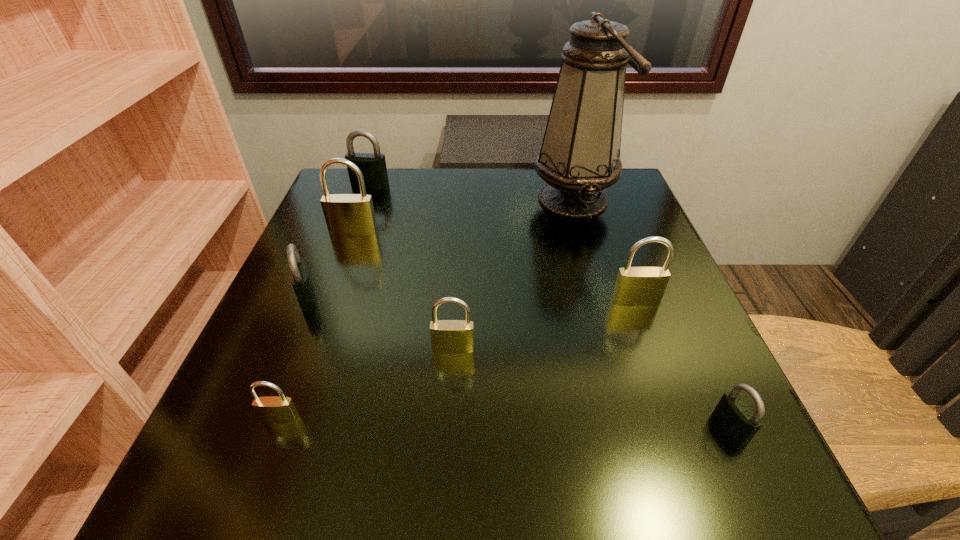
The height and width of the screenshot is (540, 960). Find the location of `the fourth object from right to left`. the fourth object from right to left is located at coordinates (447, 336).

Where is `the rightmost object`? The width and height of the screenshot is (960, 540). the rightmost object is located at coordinates (734, 416).

In order to click on the nearest black padlock in this screenshot , I will do `click(734, 416)`.

Where is `the nearest brass padlock`? The image size is (960, 540). the nearest brass padlock is located at coordinates (270, 409).

Locate an element on the screen. Image resolution: width=960 pixels, height=540 pixels. vacant space positioned on the front of the tallest object is located at coordinates point(600,296).

Where is `free spot located 0.250m on the front-facing side of the sixth nearest padlock`? This screenshot has height=540, width=960. free spot located 0.250m on the front-facing side of the sixth nearest padlock is located at coordinates (323, 319).

Locate an element on the screen. Image resolution: width=960 pixels, height=540 pixels. vacant point located on the front of the farthest black padlock is located at coordinates (342, 265).

The width and height of the screenshot is (960, 540). I want to click on vacant space located 0.060m on the front-facing side of the rightmost brass padlock, so click(x=646, y=330).

Find the location of a particular element. vacant region located on the right of the second biggest black padlock is located at coordinates (508, 297).

Identify the location of vacant space located 0.120m on the front-facing side of the sixth farthest object. (449, 418).